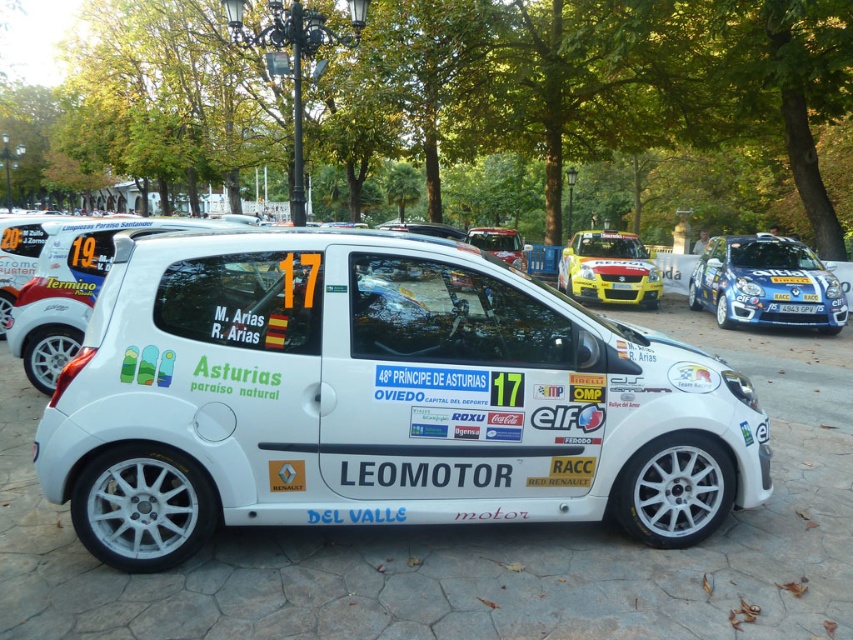
You are a photographer at the event and want to capture both the white matte rally car at center and the white matte car at center in a single photo. Which car should you focus on first to ensure both are in frame?

The white matte rally car at center is below the white matte car at center, so you should focus on the white matte car at center first to ensure both are in frame.

In the scene shown: What is the object located at the coordinates point (498,243) in the image?

The point (498,243) indicates the white matte car at center.